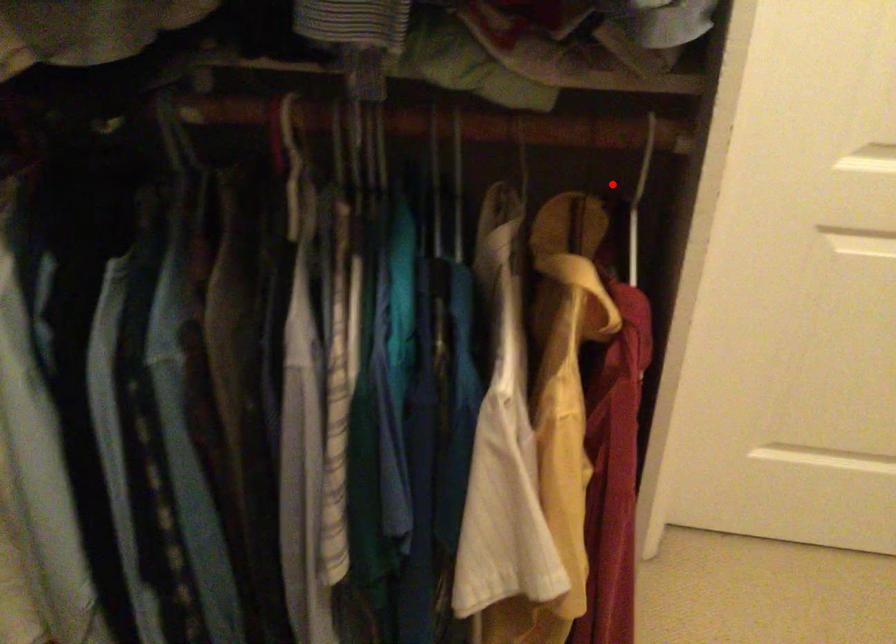
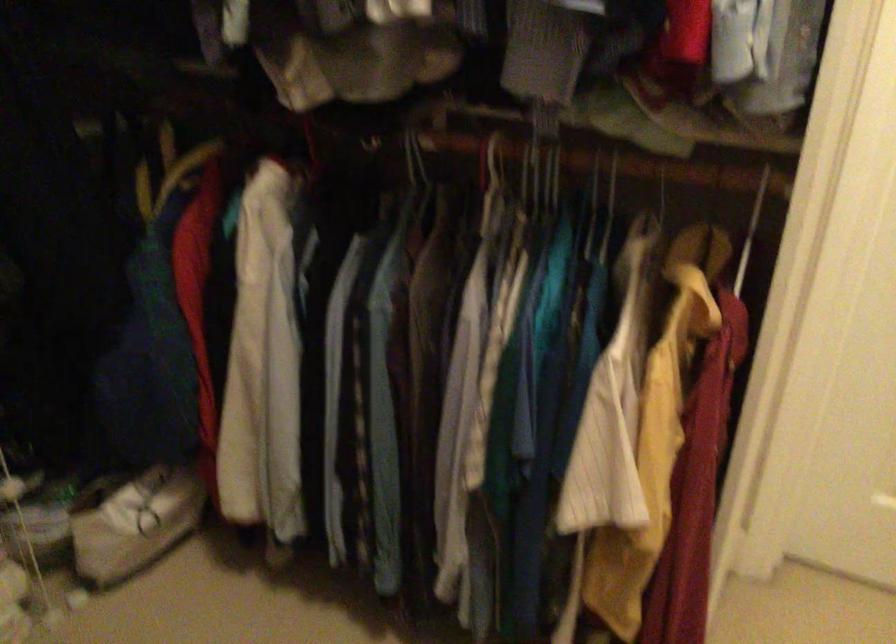
Question: I am providing you with two images of the same scene from different viewpoints. Given a red point in image1, look at the same physical point in image2. Is it:

Choices:
 (A) Closer to the viewpoint
 (B) Farther from the viewpoint

Answer: (B)